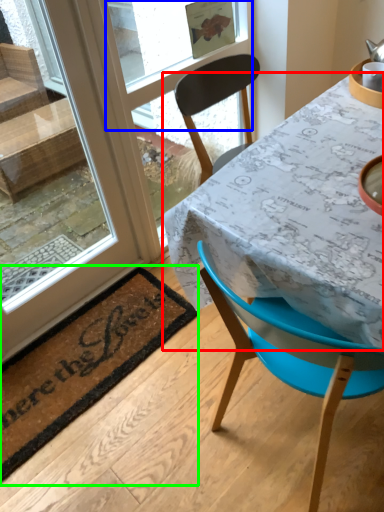
Question: Estimate the real-world distances between objects in this image. Which object is farther from table (highlighted by a red box), window screen (highlighted by a blue box) or mat (highlighted by a green box)?

Choices:
 (A) window screen
 (B) mat

Answer: (A)